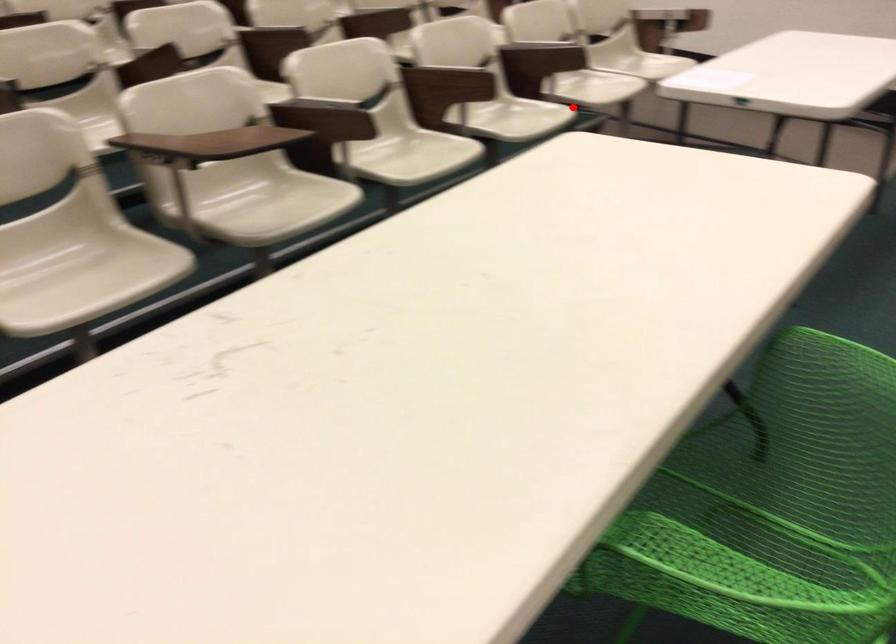
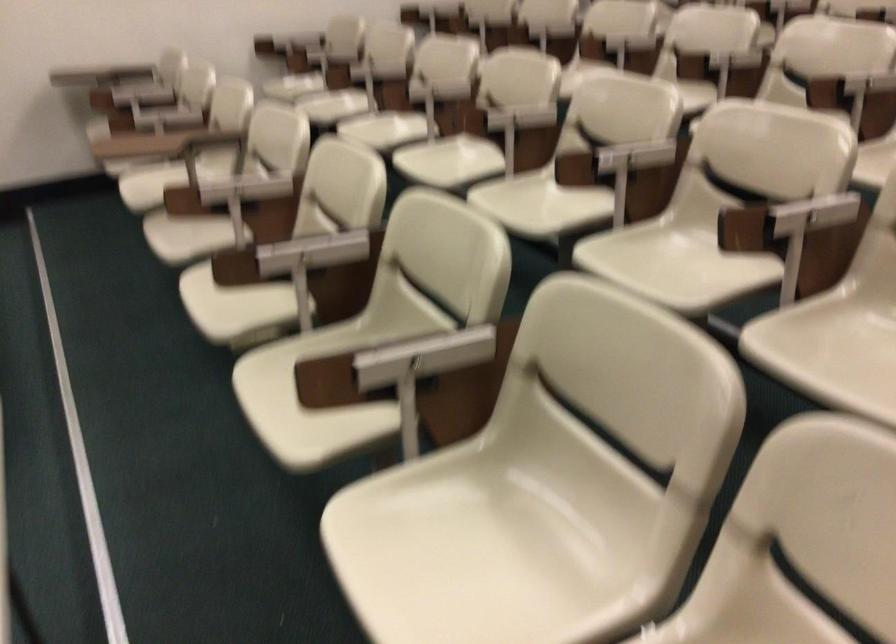
Question: I am providing you with two images of the same scene from different viewpoints. In image1, a red point is highlighted. Considering the same 3D point in image2, which of the following is correct?

Choices:
 (A) It is closer
 (B) It is farther

Answer: (A)